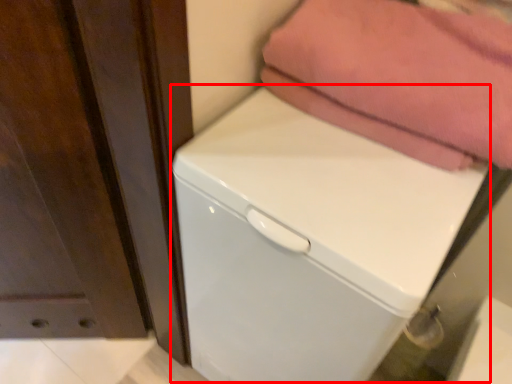
Question: Considering the relative positions of dish washer (annotated by the red box) and towel in the image provided, where is dish washer (annotated by the red box) located with respect to the staircase?

Choices:
 (A) right
 (B) left

Answer: (B)